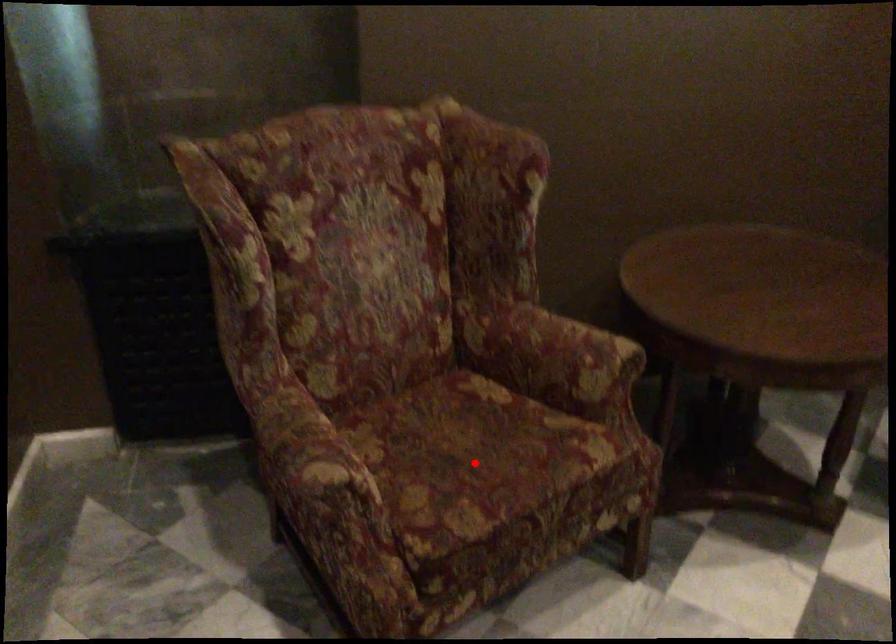
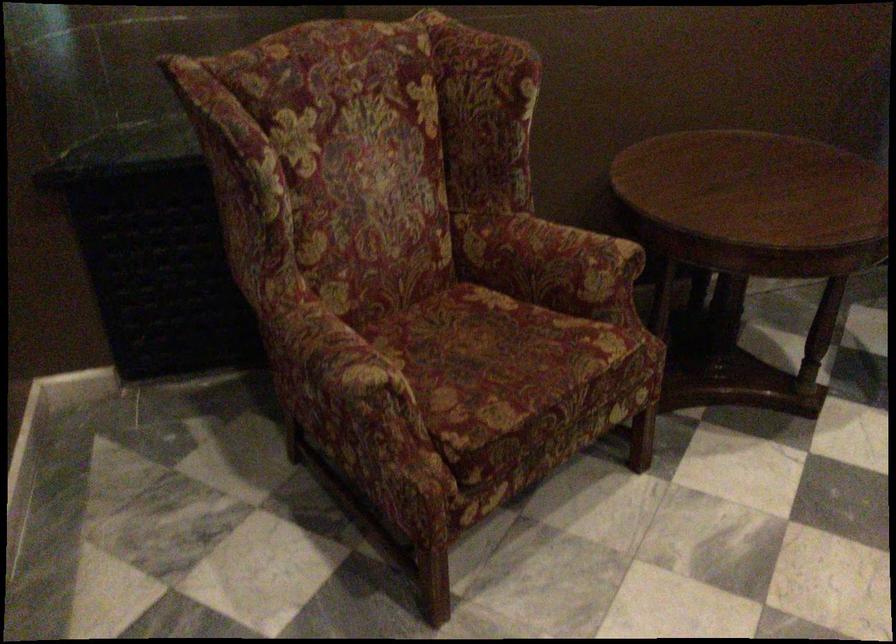
Where in the second image is the point corresponding to the highlighted location from the first image?

(495, 363)